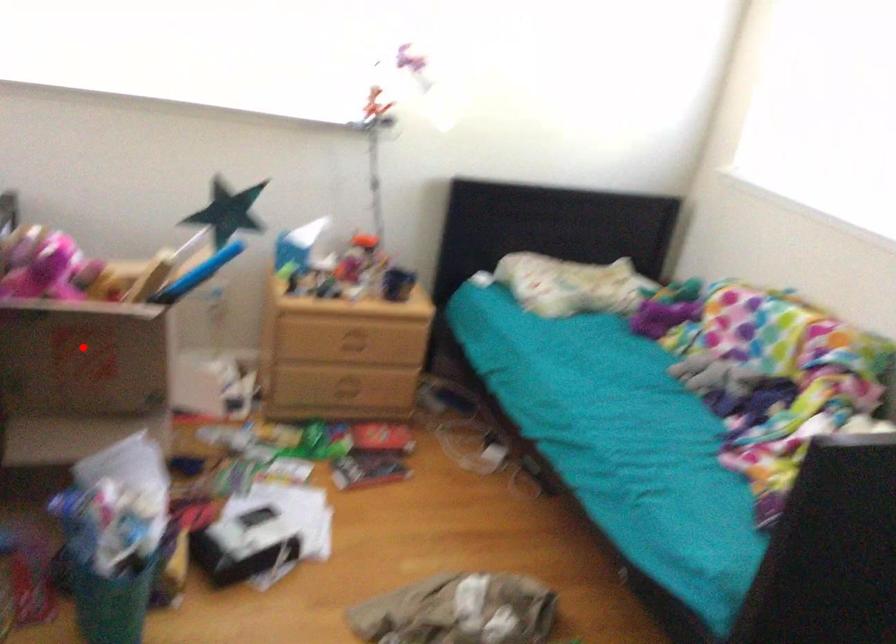
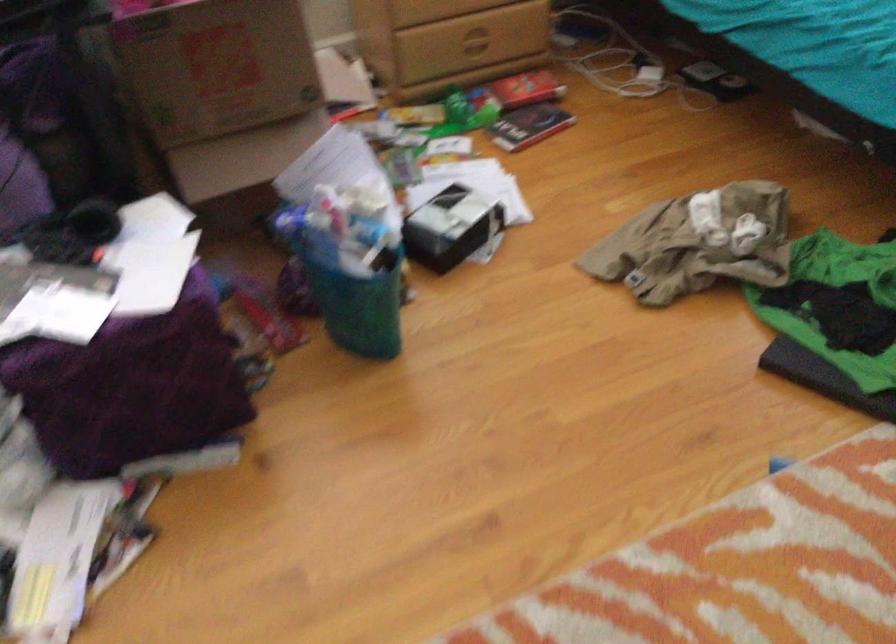
Question: I am providing you with two images of the same scene from different viewpoints. Given a red point in image1, look at the same physical point in image2. Is it:

Choices:
 (A) Closer to the viewpoint
 (B) Farther from the viewpoint

Answer: (A)